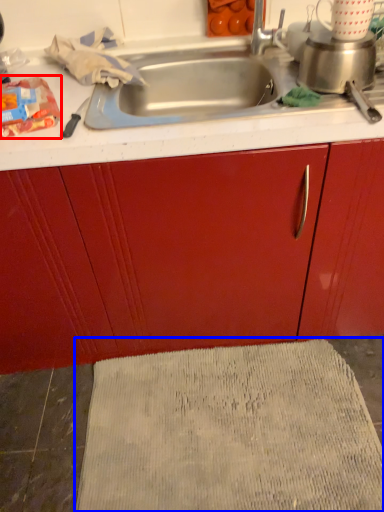
Question: Which point is closer to the camera, food (highlighted by a red box) or bath mat (highlighted by a blue box)?

Choices:
 (A) food
 (B) bath mat

Answer: (A)